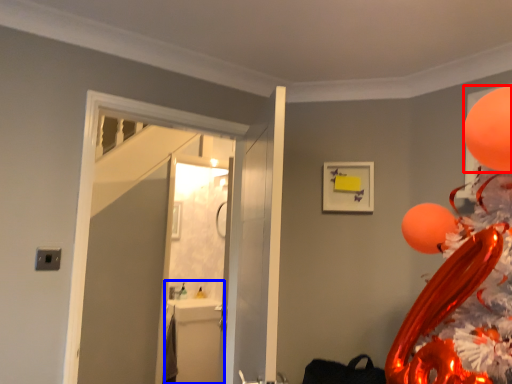
Question: Which object is closer to the camera taking this photo, balloon (highlighted by a red box) or sink (highlighted by a blue box)?

Choices:
 (A) balloon
 (B) sink

Answer: (A)